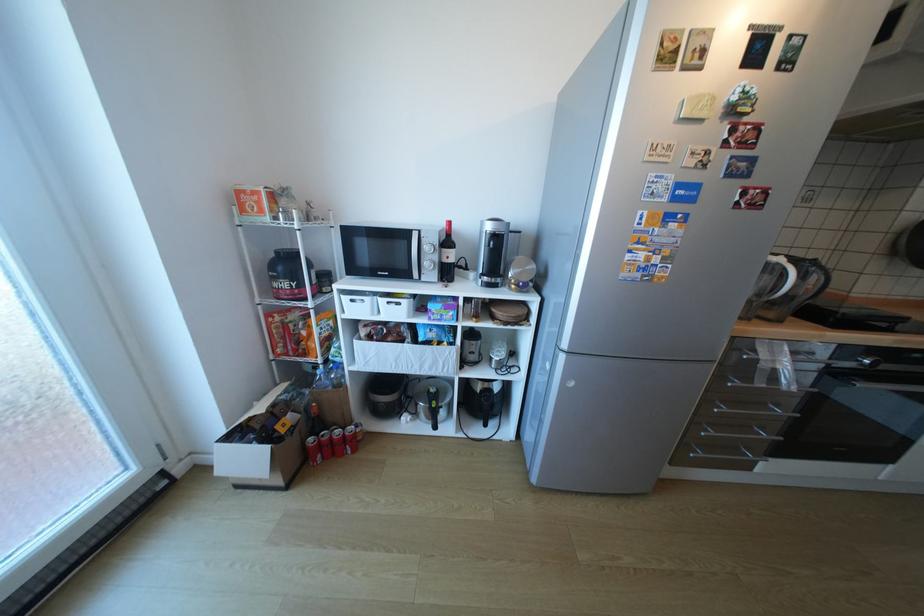
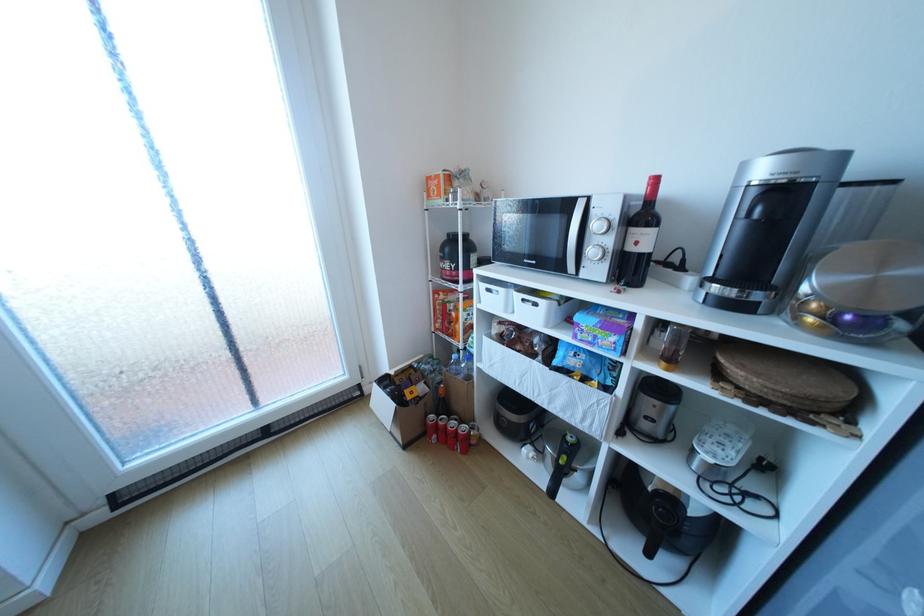
Question: The first image is from the beginning of the video and the second image is from the end. How did the camera likely rotate when shooting the video?

Choices:
 (A) Left
 (B) Right
 (C) Up
 (D) Down

Answer: (A)